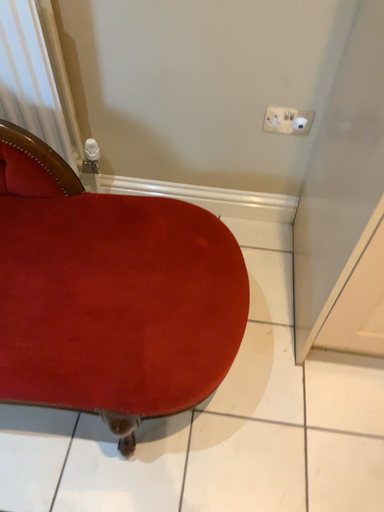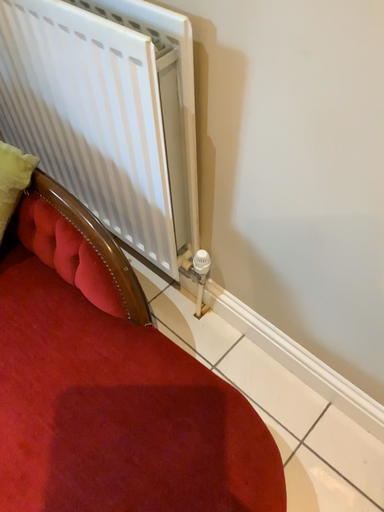
Question: How did the camera likely rotate when shooting the video?

Choices:
 (A) rotated downward
 (B) rotated upward

Answer: (B)